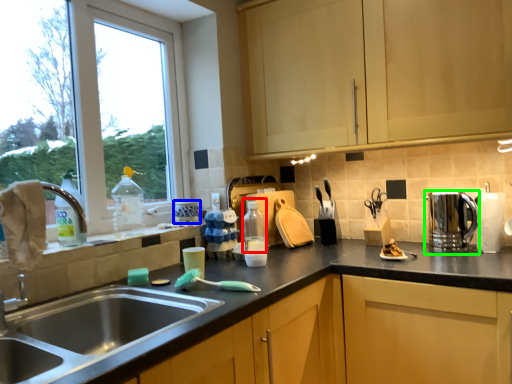
Question: Considering the real-world distances, which object is closest to bottle (highlighted by a red box)? appliance (highlighted by a blue box) or appliance (highlighted by a green box).

Choices:
 (A) appliance
 (B) appliance

Answer: (A)